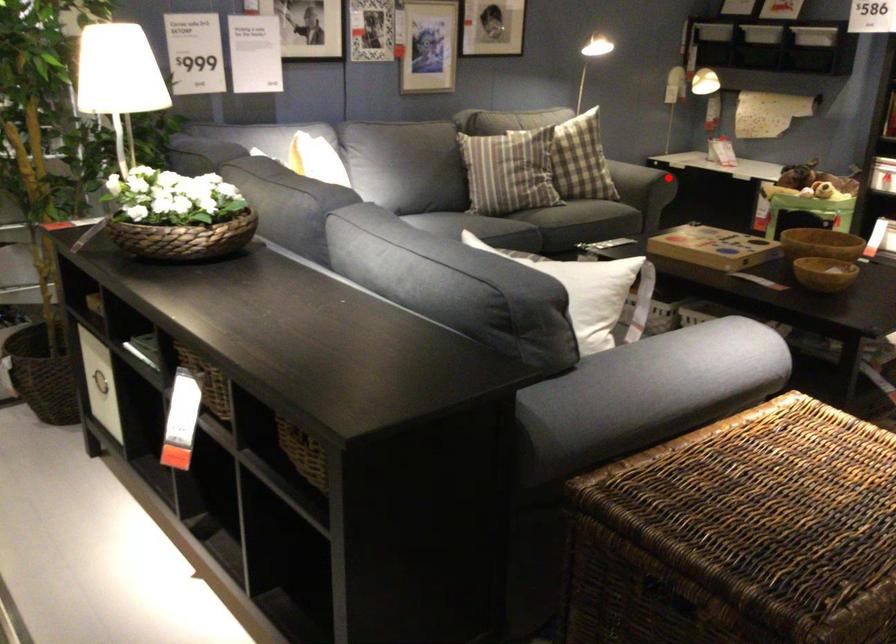
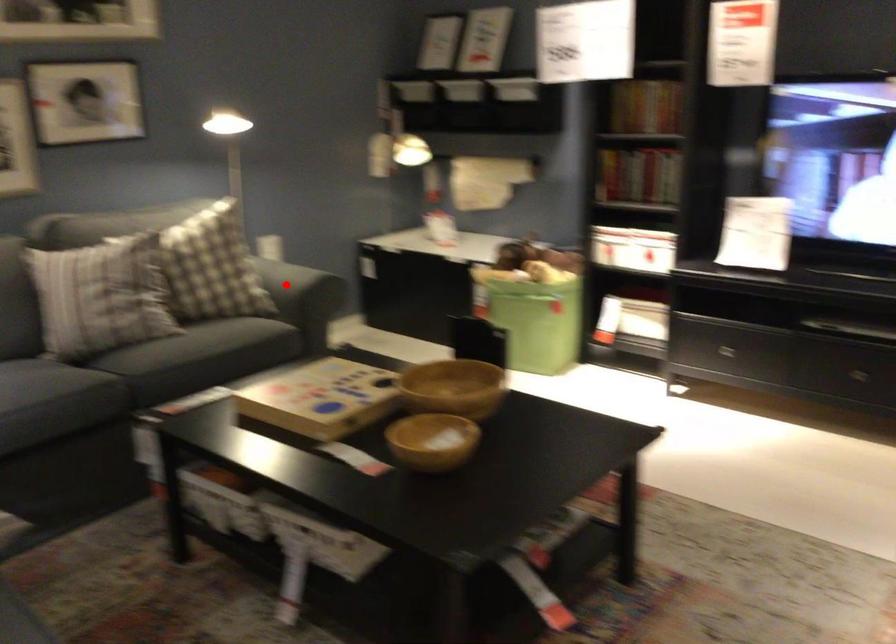
I am providing you with two images of the same scene from different viewpoints. A red point is marked on the first image and another point is marked on the second image. Is the marked point in image1 the same physical position as the marked point in image2?

Yes